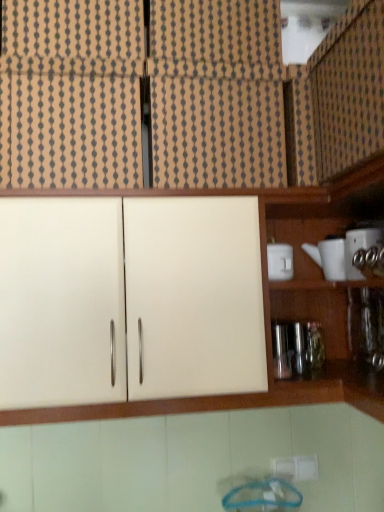
Question: Is the position of white matte cabinet at upper left, which appears as the second cabinetry when ordered from the bottom, less distant than that of white glossy teapot at right, which is the first appliance from right to left?

Choices:
 (A) yes
 (B) no

Answer: (A)

Question: Is white matte cabinet at upper left, which is the third cabinetry in top-to-bottom order, facing away from white glossy teapot at right, the 3th appliance in the left-to-right sequence?

Choices:
 (A) no
 (B) yes

Answer: (A)

Question: Could you tell me if white matte cabinet at upper left, which appears as the second cabinetry when ordered from the bottom, is facing white glossy teapot at right, which is the first appliance from right to left?

Choices:
 (A) yes
 (B) no

Answer: (B)

Question: Is white matte cabinet at upper left, which is the third cabinetry in top-to-bottom order, thinner than white glossy teapot at right, the 3th appliance in the left-to-right sequence?

Choices:
 (A) yes
 (B) no

Answer: (B)

Question: Are white matte cabinet at upper left, which is the third cabinetry in top-to-bottom order, and white glossy teapot at right, the 3th appliance in the left-to-right sequence, making contact?

Choices:
 (A) yes
 (B) no

Answer: (B)

Question: From the image's perspective, is white ceramic teapot at right, which ranks as the second appliance in right-to-left order, located above or below white glossy teapot at right, which is the first appliance from right to left?

Choices:
 (A) below
 (B) above

Answer: (A)

Question: Is white ceramic teapot at right, which is the second appliance in left-to-right order, situated inside white glossy teapot at right, the 3th appliance in the left-to-right sequence, or outside?

Choices:
 (A) outside
 (B) inside

Answer: (A)

Question: In terms of width, does white ceramic teapot at right, which ranks as the second appliance in right-to-left order, look wider or thinner when compared to white glossy teapot at right, which is the first appliance from right to left?

Choices:
 (A) thin
 (B) wide

Answer: (B)

Question: Is point (339, 245) closer or farther from the camera than point (362, 233)?

Choices:
 (A) farther
 (B) closer

Answer: (A)

Question: Relative to matte wood cabinet at upper center, the 3th cabinetry positioned from the bottom, is white glossy cup at upper right, arranged as the 1th appliance when viewed from the left, in front or behind?

Choices:
 (A) behind
 (B) front

Answer: (A)

Question: Would you say white glossy cup at upper right, arranged as the 1th appliance when viewed from the left, is inside or outside matte wood cabinet at upper center, the 3th cabinetry positioned from the bottom?

Choices:
 (A) inside
 (B) outside

Answer: (B)

Question: Visually, is white glossy cup at upper right, the third appliance in the right-to-left sequence, positioned to the left or to the right of matte wood cabinet at upper center, the second cabinetry when ordered from top to bottom?

Choices:
 (A) right
 (B) left

Answer: (A)

Question: Based on their sizes in the image, would you say white glossy cup at upper right, arranged as the 1th appliance when viewed from the left, is bigger or smaller than matte wood cabinet at upper center, the second cabinetry when ordered from top to bottom?

Choices:
 (A) big
 (B) small

Answer: (B)

Question: Would you say white glossy teapot at right, the 3th appliance in the left-to-right sequence, is inside or outside matte wood cabinet at upper right, the 1th cabinetry in the top-to-bottom sequence?

Choices:
 (A) outside
 (B) inside

Answer: (A)

Question: From a real-world perspective, is white glossy teapot at right, which is the first appliance from right to left, physically located above or below matte wood cabinet at upper right, the 4th cabinetry positioned from the bottom?

Choices:
 (A) above
 (B) below

Answer: (B)